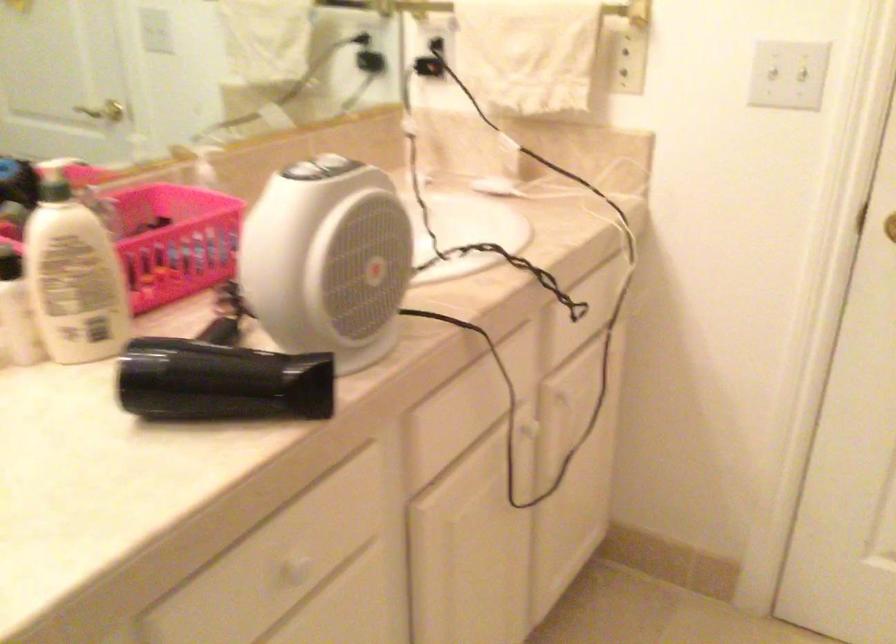
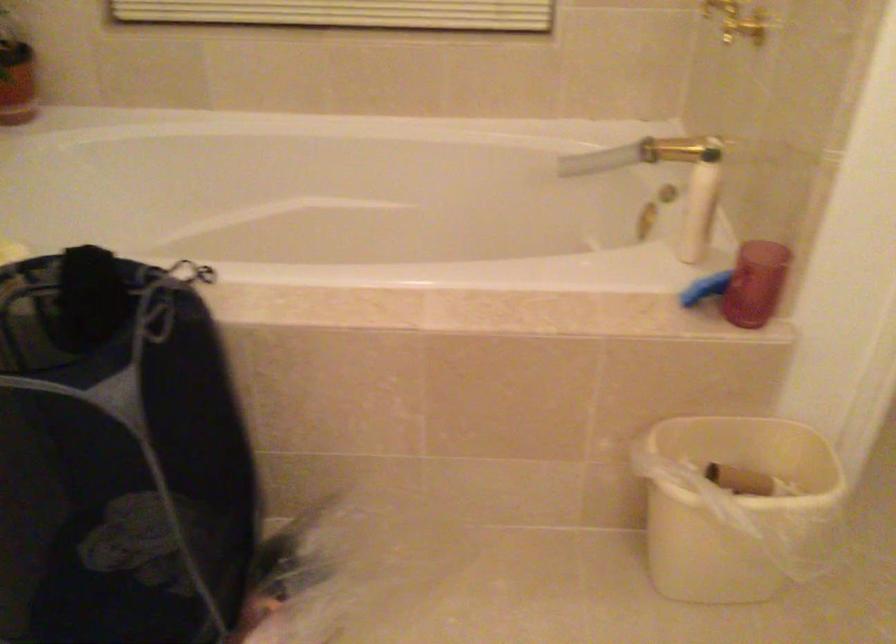
The first image is from the beginning of the video and the second image is from the end. How did the camera likely rotate when shooting the video?

The rotation direction of the camera is right-down.